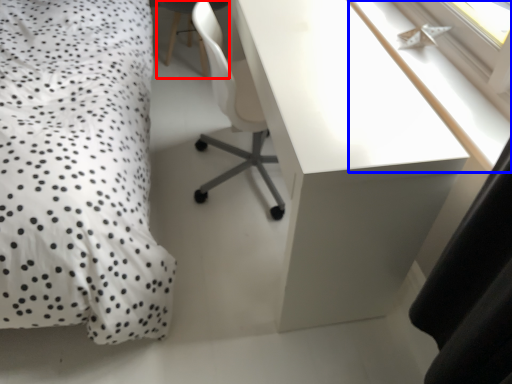
Question: Which object is further to the camera taking this photo, computer chair (highlighted by a red box) or window sill (highlighted by a blue box)?

Choices:
 (A) computer chair
 (B) window sill

Answer: (A)